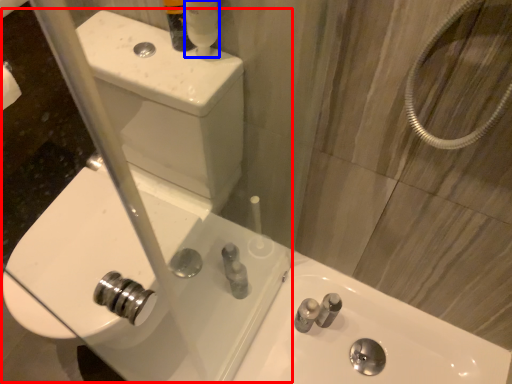
Question: Which object appears farthest to the camera in this image, sink (highlighted by a red box) or mouthwash (highlighted by a blue box)?

Choices:
 (A) sink
 (B) mouthwash

Answer: (B)